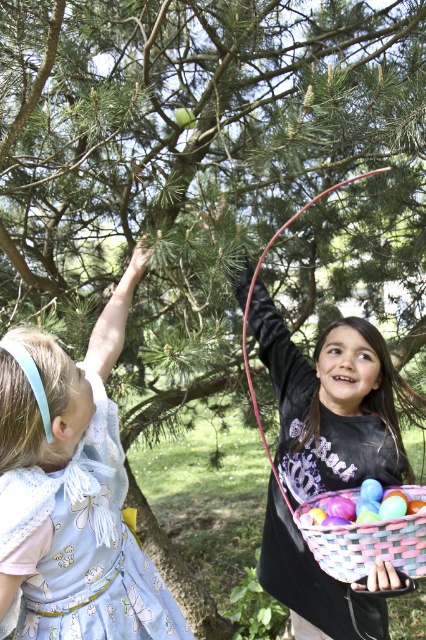
Question: Does black matte shirt at upper center have a larger size compared to pastel woven basket at lower center?

Choices:
 (A) yes
 (B) no

Answer: (A)

Question: Estimate the real-world distances between objects in this image. Which object is farther from the light blue fabric dress at upper left?

Choices:
 (A) black matte shirt at upper center
 (B) green pine tree at upper center
 (C) pastel woven basket at lower center

Answer: (B)

Question: Is green pine tree at upper center further to camera compared to light blue fabric dress at upper left?

Choices:
 (A) yes
 (B) no

Answer: (A)

Question: Based on their relative distances, which object is farther from the pastel woven basket at lower center?

Choices:
 (A) light blue fabric dress at upper left
 (B) green pine tree at upper center
 (C) black matte shirt at upper center

Answer: (B)

Question: Does green pine tree at upper center appear over black matte shirt at upper center?

Choices:
 (A) yes
 (B) no

Answer: (A)

Question: Which point is farther to the camera?

Choices:
 (A) click(x=402, y=520)
 (B) click(x=178, y=173)

Answer: (B)